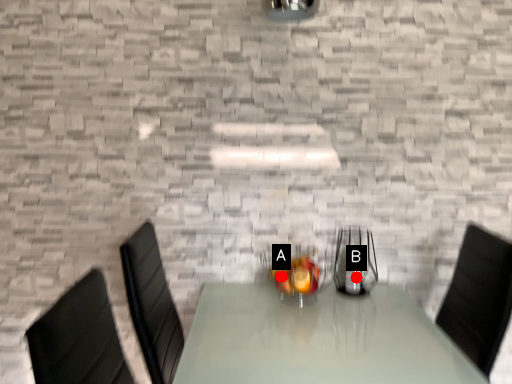
Question: Two points are circled on the image, labeled by A and B beside each circle. Among these points, which one is farthest from the camera?

Choices:
 (A) A is further
 (B) B is further

Answer: (B)